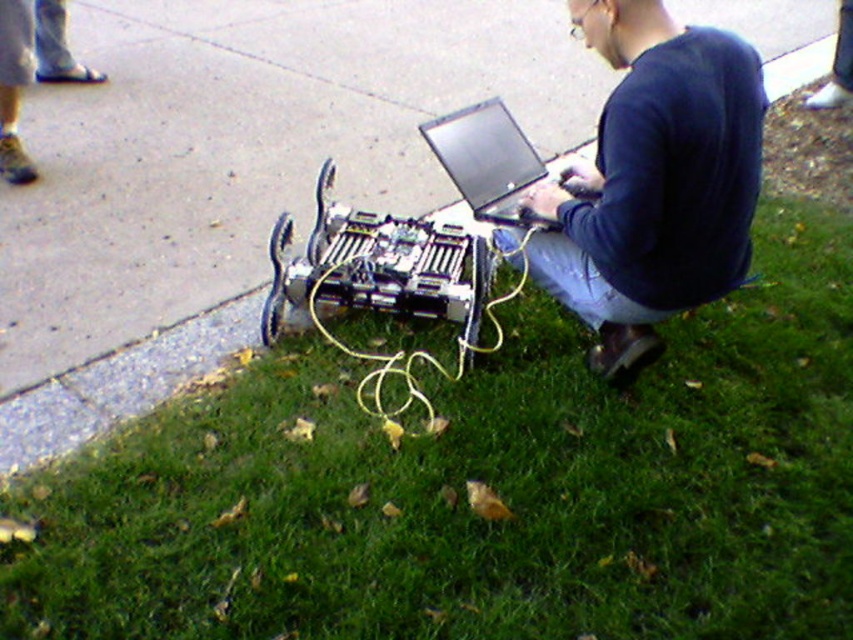
From the picture: You are a delivery robot that needs to move from the concrete at lower left to the black glossy laptop at center. Can you move directly to the laptop without going around it?

The concrete at lower left is to the left of the black glossy laptop at center, so you can move directly to the laptop without going around it since the laptop is positioned to the right of the concrete.

Based on the photo, you are a delivery robot navigating through the scene. You need to move from your current position near the robotic platform to the black glossy laptop at center without stepping on the green grass at lower right. Is this possible?

The green grass at lower right is to the right of the black glossy laptop at center, so moving from the robotic platform to the laptop while avoiding the grass is possible by moving left or forward, as the grass is positioned to the right of the laptop.